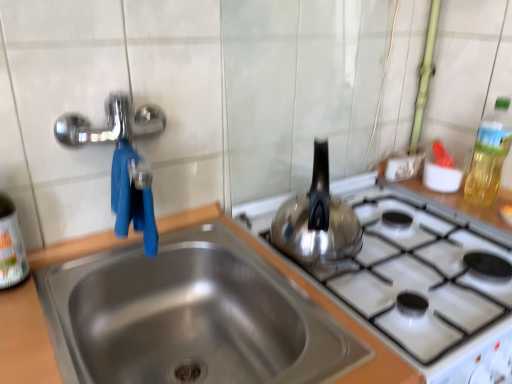
Question: Does white plastic bottle at left, the 1th bottle in the front-to-back sequence, have a lesser height compared to stainless steel sink at center?

Choices:
 (A) yes
 (B) no

Answer: (B)

Question: Is white plastic bottle at left, which appears as the 2th bottle when viewed from the back, located outside stainless steel sink at center?

Choices:
 (A) yes
 (B) no

Answer: (A)

Question: Does white plastic bottle at left, which ranks as the 1th bottle in left-to-right order, appear on the right side of stainless steel sink at center?

Choices:
 (A) no
 (B) yes

Answer: (A)

Question: Could you tell me if white plastic bottle at left, which appears as the 2th bottle when viewed from the back, is turned towards stainless steel sink at center?

Choices:
 (A) no
 (B) yes

Answer: (A)

Question: Is white plastic bottle at left, which appears as the 2th bottle when viewed from the back, in front of stainless steel sink at center?

Choices:
 (A) no
 (B) yes

Answer: (A)

Question: Does white plastic bottle at left, acting as the second bottle starting from the right, have a lesser width compared to stainless steel sink at center?

Choices:
 (A) no
 (B) yes

Answer: (B)

Question: From the image's perspective, is shiny metallic kettle at right on white plastic bottle at left, which ranks as the 1th bottle in left-to-right order?

Choices:
 (A) yes
 (B) no

Answer: (A)

Question: Is shiny metallic kettle at right completely or partially outside of white plastic bottle at left, acting as the second bottle starting from the right?

Choices:
 (A) no
 (B) yes

Answer: (B)

Question: Is shiny metallic kettle at right aimed at white plastic bottle at left, which ranks as the 1th bottle in left-to-right order?

Choices:
 (A) no
 (B) yes

Answer: (A)

Question: Is shiny metallic kettle at right smaller than white plastic bottle at left, which ranks as the 1th bottle in left-to-right order?

Choices:
 (A) yes
 (B) no

Answer: (B)

Question: Considering the relative positions of shiny metallic kettle at right and white plastic bottle at left, which appears as the 2th bottle when viewed from the back, in the image provided, is shiny metallic kettle at right behind white plastic bottle at left, which appears as the 2th bottle when viewed from the back,?

Choices:
 (A) yes
 (B) no

Answer: (A)

Question: Considering the relative sizes of shiny metallic kettle at right and white plastic bottle at left, which appears as the 2th bottle when viewed from the back, in the image provided, is shiny metallic kettle at right shorter than white plastic bottle at left, which appears as the 2th bottle when viewed from the back,?

Choices:
 (A) yes
 (B) no

Answer: (A)

Question: Considering the relative sizes of stainless steel sink at center and white plastic bottle at left, which ranks as the 1th bottle in left-to-right order, in the image provided, is stainless steel sink at center shorter than white plastic bottle at left, which ranks as the 1th bottle in left-to-right order,?

Choices:
 (A) yes
 (B) no

Answer: (A)